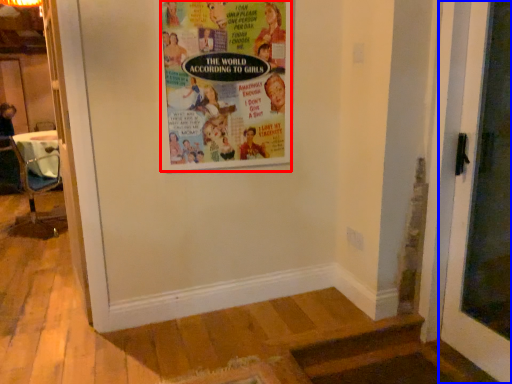
Question: Which point is further to the camera, poster (highlighted by a red box) or door (highlighted by a blue box)?

Choices:
 (A) poster
 (B) door

Answer: (A)